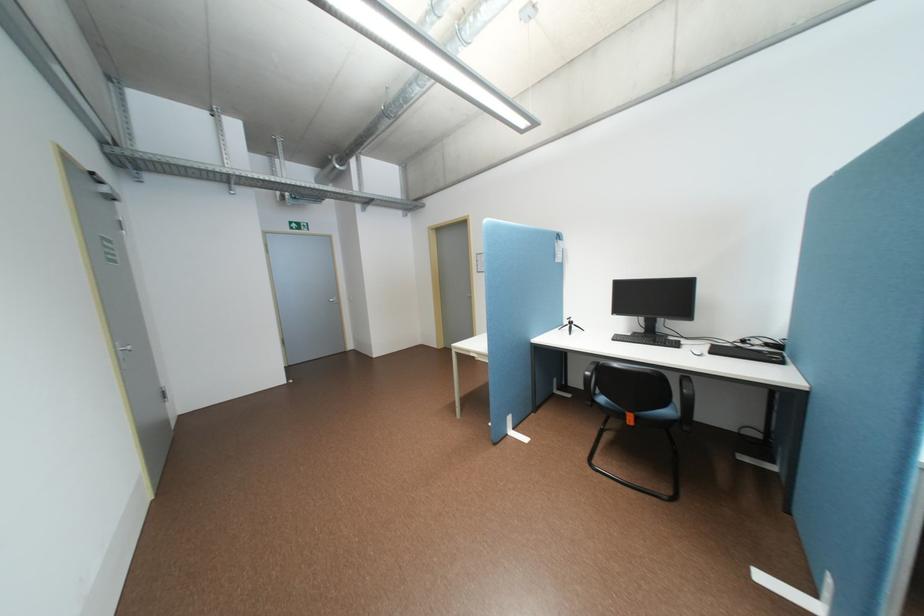
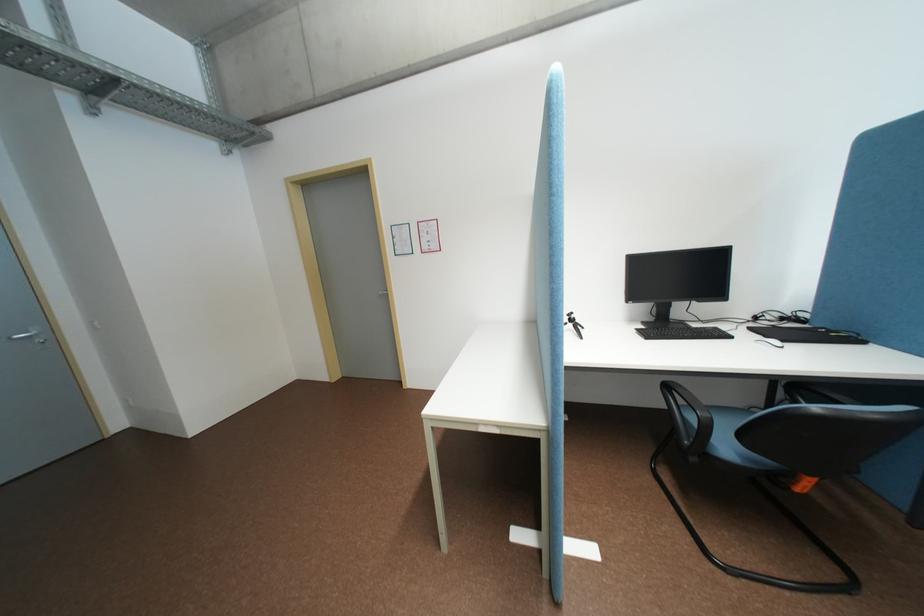
Where in the second image is the point corresponding to [652,331] from the first image?

(662, 318)